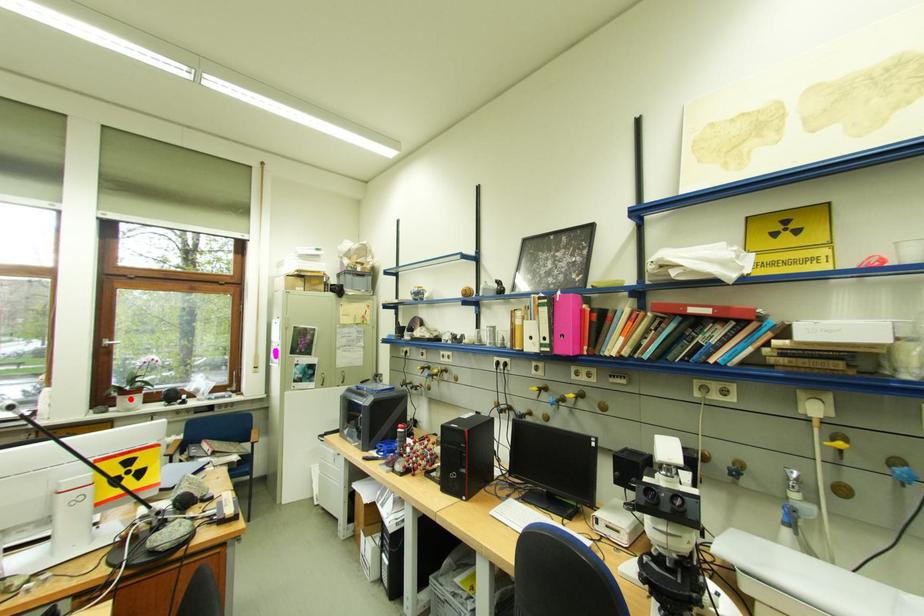
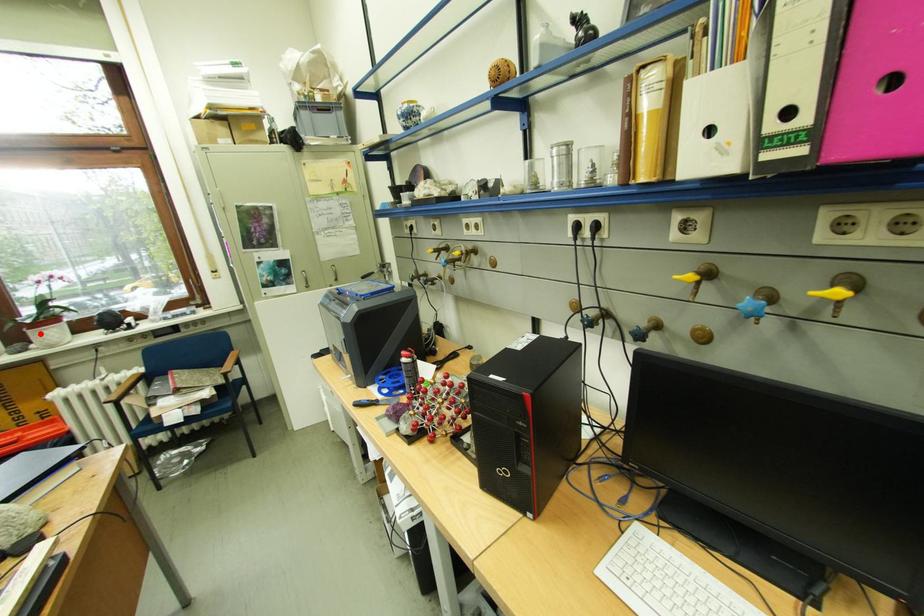
I am providing you with two images of the same scene from different viewpoints. A red point is marked on the first image and another point is marked on the second image. Do the highlighted points in image1 and image2 indicate the same real-world spot?

Yes